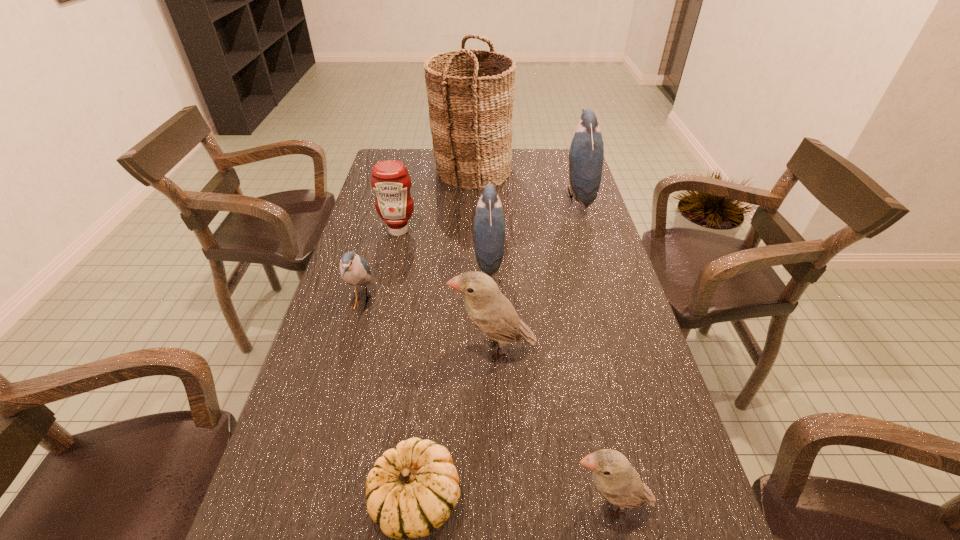
You are a GUI agent. You are given a task and a screenshot of the screen. Output one action in this format:
    pyautogui.click(x=<x>, y=<y>)
    Task: Click on the fourth closest object to the second blue bird from left to right
    The height and width of the screenshot is (540, 960).
    Given the screenshot: What is the action you would take?
    pyautogui.click(x=354, y=269)

Image resolution: width=960 pixels, height=540 pixels. Identify the location of the closest bird relative to the second biggest blue bird. (489, 310).

Identify which bird is located as the third nearest to the shortest object. Please provide its 2D coordinates. Your answer should be formatted as a tuple, i.e. [(x, y)], where the tuple contains the x and y coordinates of a point satisfying the conditions above.

[(354, 269)]

Choose which blue bird is the nearest neighbor to the shortest object. Please provide its 2D coordinates. Your answer should be formatted as a tuple, i.e. [(x, y)], where the tuple contains the x and y coordinates of a point satisfying the conditions above.

[(354, 269)]

You are a GUI agent. You are given a task and a screenshot of the screen. Output one action in this format:
    pyautogui.click(x=<x>, y=<y>)
    Task: Click on the closest blue bird to the basket
    
    Given the screenshot: What is the action you would take?
    pyautogui.click(x=586, y=153)